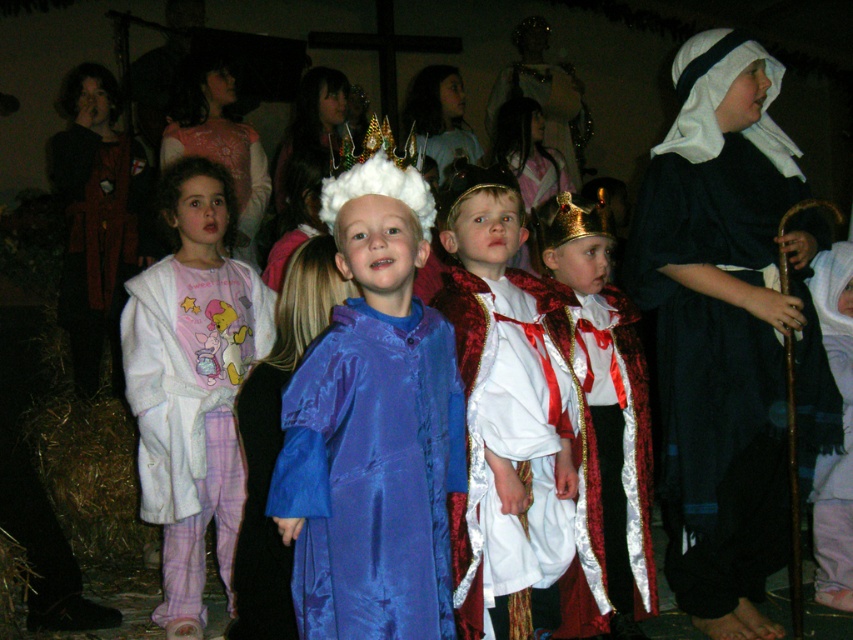
Does white fluffy crown at center come behind gold glittering crown at center?

No.

What do you see at coordinates (376, 177) in the screenshot? This screenshot has height=640, width=853. I see `white fluffy crown at center` at bounding box center [376, 177].

Find the location of a particular element. The height and width of the screenshot is (640, 853). white fluffy crown at center is located at coordinates (376, 177).

Can you confirm if satin blue robe at center is positioned above gold metallic crown at center?

Actually, satin blue robe at center is below gold metallic crown at center.

Image resolution: width=853 pixels, height=640 pixels. What do you see at coordinates (373, 420) in the screenshot? I see `satin blue robe at center` at bounding box center [373, 420].

The height and width of the screenshot is (640, 853). Identify the location of satin blue robe at center. (373, 420).

Which of these two, white fluffy blanket at lower right or white fluffy crown at center, stands shorter?

With less height is white fluffy crown at center.

Between white fluffy blanket at lower right and white fluffy crown at center, which one has more height?

white fluffy blanket at lower right is taller.

Describe the element at coordinates (843, 432) in the screenshot. This screenshot has height=640, width=853. I see `white fluffy blanket at lower right` at that location.

Where is `white fluffy blanket at lower right`? white fluffy blanket at lower right is located at coordinates (843, 432).